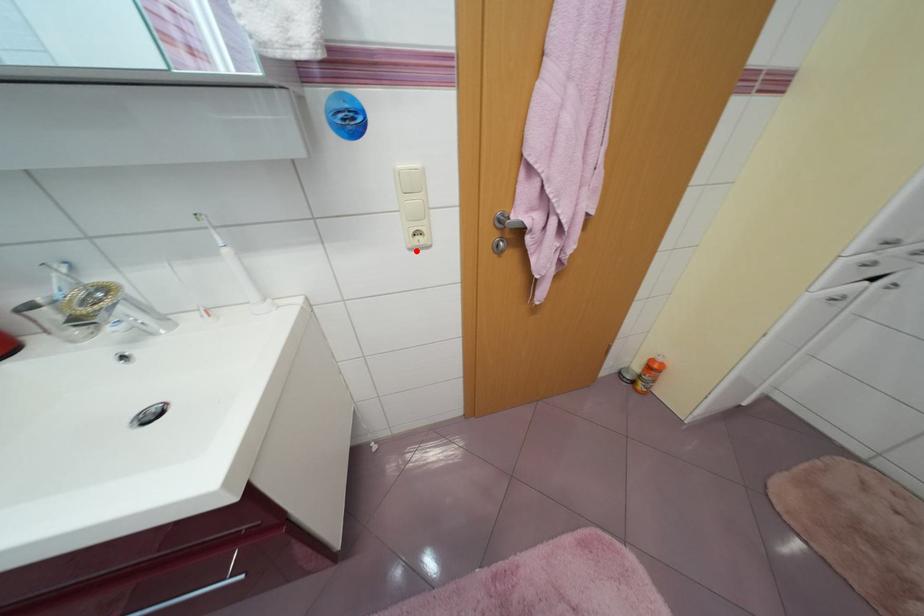
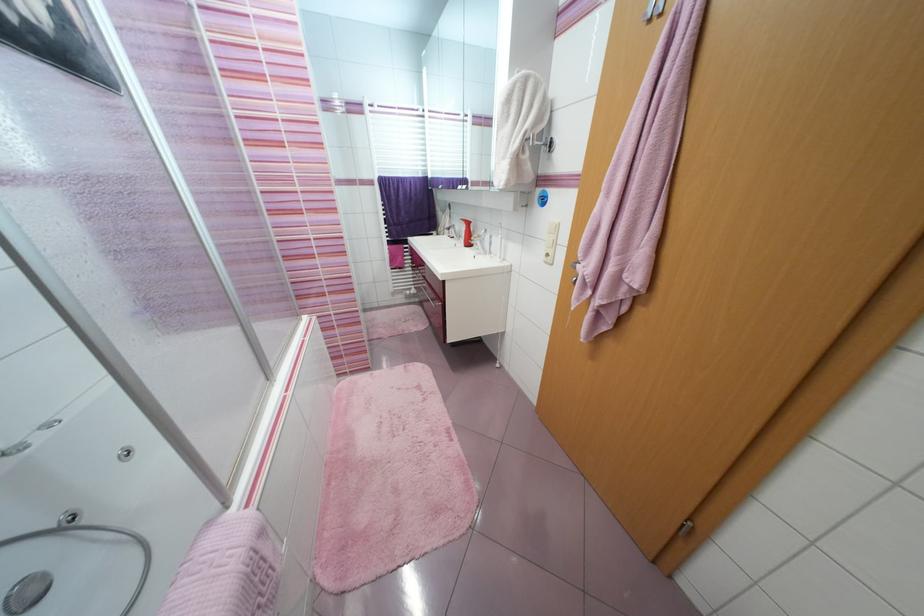
Question: I am providing you with two images of the same scene from different viewpoints. Image1 has a red point marked. In image2, the corresponding 3D location appears at what relative position? Reply with the corresponding letter.

Choices:
 (A) Closer
 (B) Farther

Answer: (A)